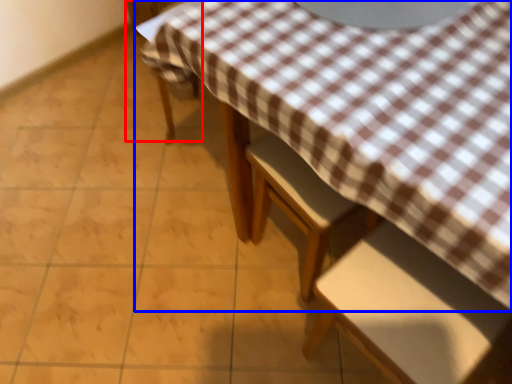
Question: Which object appears closest to the camera in this image, chair (highlighted by a red box) or table (highlighted by a blue box)?

Choices:
 (A) chair
 (B) table

Answer: (B)